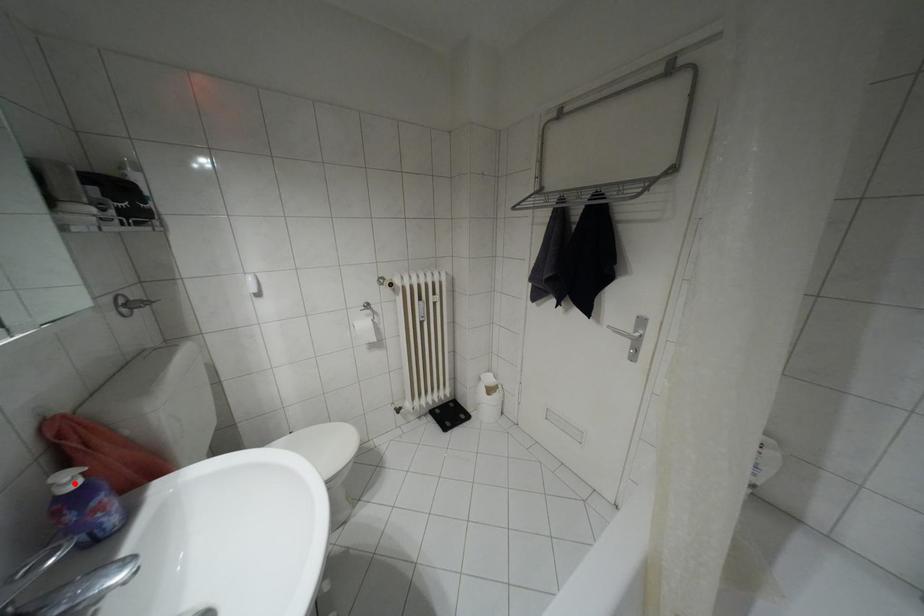
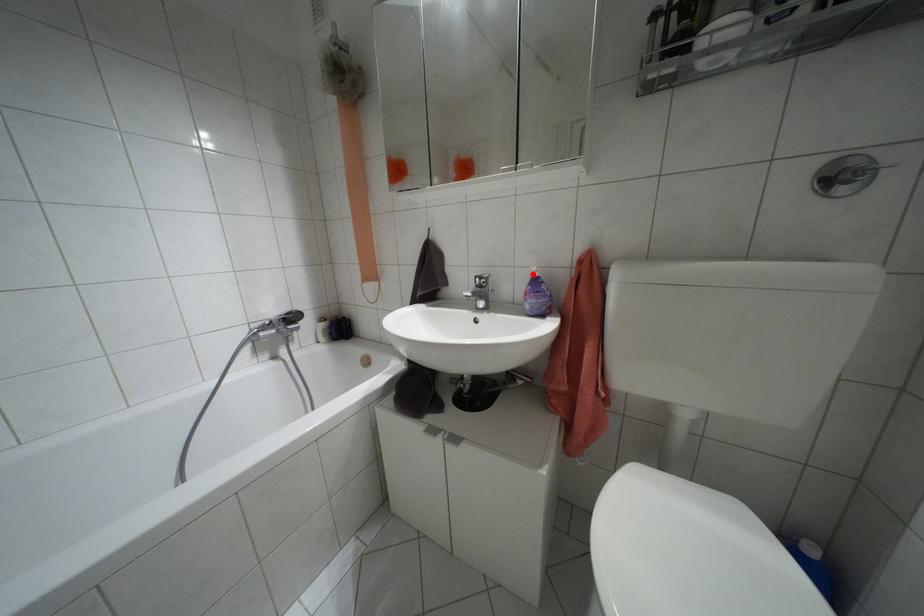
I am providing you with two images of the same scene from different viewpoints. A red point is marked on the first image and another point is marked on the second image. Is the marked point in image1 the same physical position as the marked point in image2?

Yes